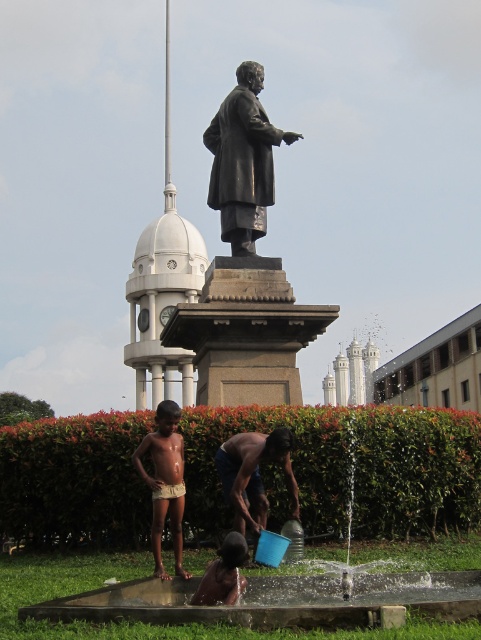
You are a photographer trying to capture both the light brown skin at center and the white glossy flag pole at upper center in a single frame. Based on their sizes, which object should you focus on first to ensure both are in the frame?

The light brown skin at center has a smaller size compared to the white glossy flag pole at upper center, so you should focus on the white glossy flag pole at upper center first to ensure both are in the frame.

You are a tourist in the park and want to take a photo of the bronze statue at center and the dark skin human at lower center together in the frame. Based on their positions, which one should you place on the left side of your camera view to include both in the photo?

To include both the bronze statue at center and the dark skin human at lower center in the photo, you should place the dark skin human at lower center on the left side of your camera view since the bronze statue at center is to the right of the dark skin human at lower center.

You are standing at the entrance of the park and see the bronze statue at center. If you walk straight ahead, will you reach the statue before the clock tower?

Yes, because the bronze statue at center is closer to your current position at the entrance than the clock tower.